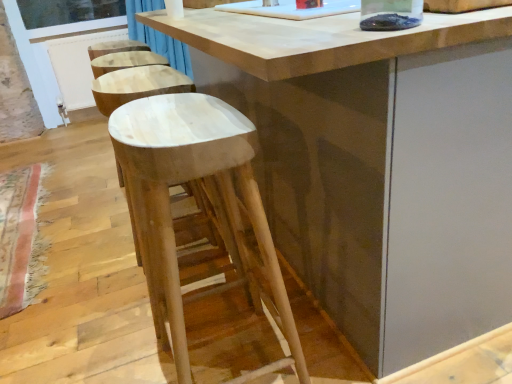
Question: Does clear glass window screen at upper left have a lesser height compared to natural wood stool at center?

Choices:
 (A) no
 (B) yes

Answer: (B)

Question: Is clear glass window screen at upper left directly adjacent to natural wood stool at center?

Choices:
 (A) yes
 (B) no

Answer: (B)

Question: Is clear glass window screen at upper left wider than natural wood stool at center?

Choices:
 (A) yes
 (B) no

Answer: (B)

Question: Is clear glass window screen at upper left in front of natural wood stool at center?

Choices:
 (A) no
 (B) yes

Answer: (A)

Question: Is clear glass window screen at upper left completely or partially outside of natural wood stool at center?

Choices:
 (A) yes
 (B) no

Answer: (A)

Question: Considering the positions of white plastic screen door at left and natural wood table at center in the image, is white plastic screen door at left wider or thinner than natural wood table at center?

Choices:
 (A) wide
 (B) thin

Answer: (B)

Question: In terms of height, does white plastic screen door at left look taller or shorter compared to natural wood table at center?

Choices:
 (A) tall
 (B) short

Answer: (A)

Question: Is point (60, 64) positioned closer to the camera than point (402, 52)?

Choices:
 (A) farther
 (B) closer

Answer: (A)

Question: Is white plastic screen door at left to the left or to the right of natural wood table at center in the image?

Choices:
 (A) left
 (B) right

Answer: (A)

Question: Considering the positions of white plastic screen door at left and natural wood stool at center in the image, is white plastic screen door at left taller or shorter than natural wood stool at center?

Choices:
 (A) tall
 (B) short

Answer: (A)

Question: Considering their positions, is white plastic screen door at left located in front of or behind natural wood stool at center?

Choices:
 (A) behind
 (B) front

Answer: (A)

Question: From a real-world perspective, is white plastic screen door at left positioned above or below natural wood stool at center?

Choices:
 (A) above
 (B) below

Answer: (A)

Question: Would you say white plastic screen door at left is inside or outside natural wood stool at center?

Choices:
 (A) outside
 (B) inside

Answer: (A)

Question: From the image's perspective, is natural wood stool at center located above or below clear glass window screen at upper left?

Choices:
 (A) below
 (B) above

Answer: (A)

Question: From a real-world perspective, is natural wood stool at center above or below clear glass window screen at upper left?

Choices:
 (A) below
 (B) above

Answer: (A)